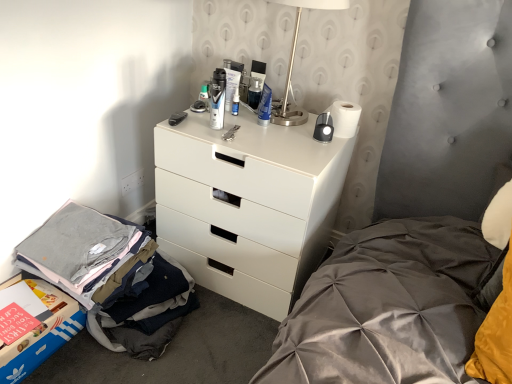
Identify the location of vacant space in between white matte toilet paper at upper right and blue plastic tube at center, which is the 1th toiletry from right to left. The height and width of the screenshot is (384, 512). (292, 129).